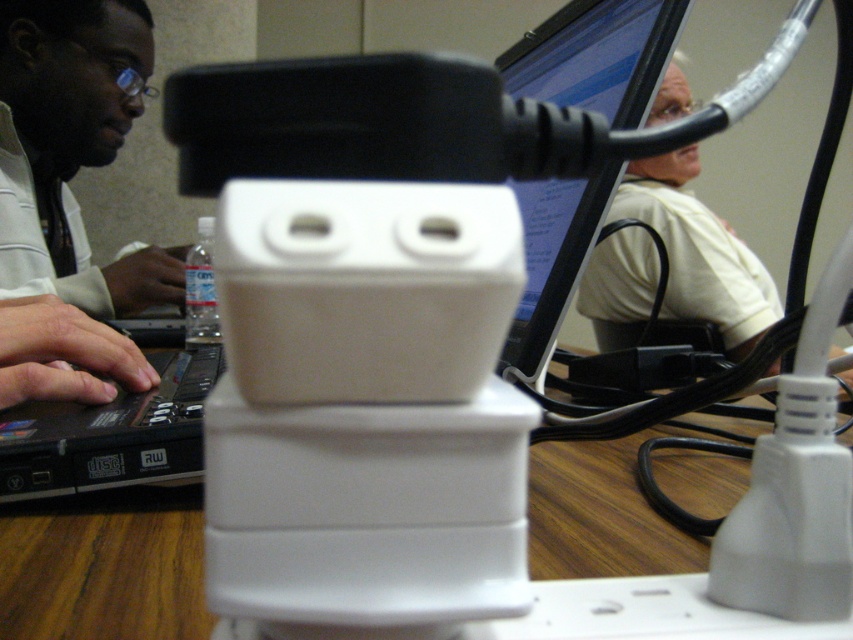
You are organizing a conference room setup and need to place the matte black laptop at left and the wooden table at center. Given their sizes, which object requires more space for placement?

The matte black laptop at left requires more space for placement since it is bigger than the wooden table at center according to the description.

You are a photographer setting up a shot of the workspace. You need to ensure that the white matte shirt at upper right and the wooden table at center are both in focus. Based on their positions, which object should be closer to the camera to achieve this?

The white matte shirt at upper right is taller than the wooden table at center, so to have both in focus, the white matte shirt at upper right should be closer to the camera since it is taller and requires less depth of field adjustment compared to the shorter wooden table at center.

You are a photographer setting up a shot of the workspace. You need to ensure that the white matte shirt at upper right and the matte black hands at left are both in focus. Given their height difference, which one should you focus on first to maximize the chances of both being sharp?

The white matte shirt at upper right is much taller than the matte black hands at left. To maximize focus on both, you should focus on the white matte shirt at upper right first since it is farther away, allowing the depth of field to cover the closer matte black hands at left.